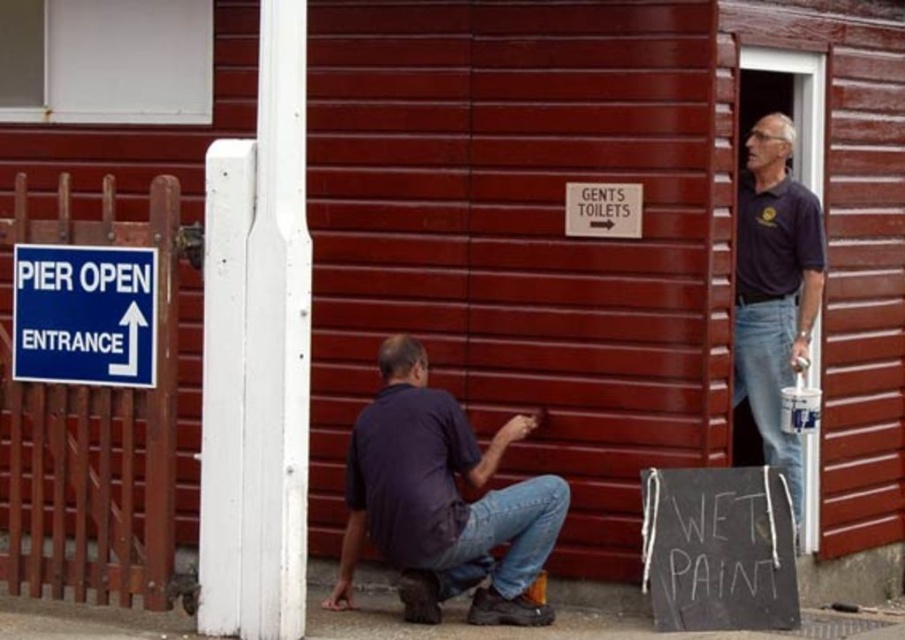
Question: Does matte dark blue shirt at center appear on the right side of blue plastic sign at upper left?

Choices:
 (A) no
 (B) yes

Answer: (B)

Question: Which point is closer to the camera?

Choices:
 (A) (113, 252)
 (B) (783, 221)
 (C) (551, 531)

Answer: (A)

Question: Can you confirm if matte dark blue shirt at center is bigger than blue plastic sign at upper left?

Choices:
 (A) no
 (B) yes

Answer: (B)

Question: Based on their relative distances, which object is nearer to the matte dark blue shirt at center?

Choices:
 (A) blue plastic sign at upper left
 (B) dark blue shirt at upper right

Answer: (A)

Question: Observing the image, what is the correct spatial positioning of dark blue shirt at upper right in reference to blue plastic sign at upper left?

Choices:
 (A) above
 (B) below

Answer: (B)

Question: Which is nearer to the blue plastic sign at upper left?

Choices:
 (A) dark blue shirt at upper right
 (B) matte dark blue shirt at center

Answer: (B)